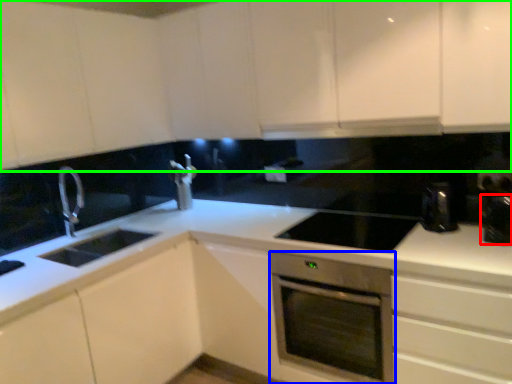
Question: Considering the real-world distances, which object is farthest from appliance (highlighted by a red box)? home appliance (highlighted by a blue box) or cabinetry (highlighted by a green box)?

Choices:
 (A) home appliance
 (B) cabinetry

Answer: (B)